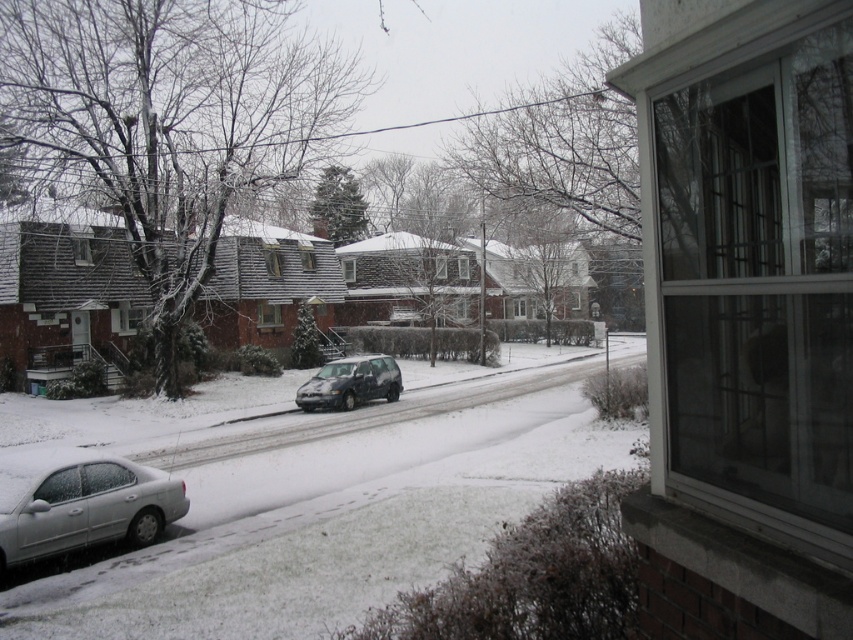
Question: Does white matte sedan at lower left have a smaller size compared to satin black suv at center?

Choices:
 (A) yes
 (B) no

Answer: (A)

Question: Does white matte sedan at lower left appear under satin black suv at center?

Choices:
 (A) yes
 (B) no

Answer: (A)

Question: Among these objects, which one is farthest from the camera?

Choices:
 (A) satin black suv at center
 (B) white matte sedan at lower left

Answer: (A)

Question: Which point is farther from the camera taking this photo?

Choices:
 (A) (329, 392)
 (B) (3, 470)

Answer: (A)

Question: Considering the relative positions of white matte sedan at lower left and satin black suv at center in the image provided, where is white matte sedan at lower left located with respect to satin black suv at center?

Choices:
 (A) right
 (B) left

Answer: (B)

Question: Which of the following is the farthest from the observer?

Choices:
 (A) satin black suv at center
 (B) white matte sedan at lower left

Answer: (A)